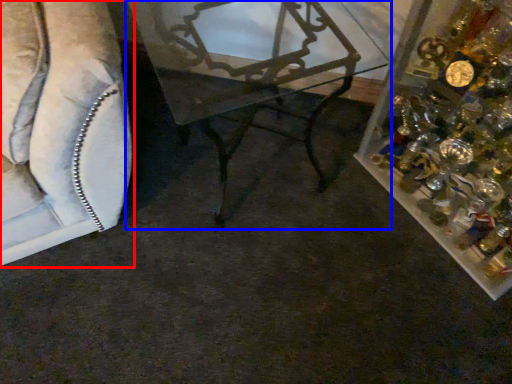
Question: Which object appears closest to the camera in this image, furniture (highlighted by a red box) or table (highlighted by a blue box)?

Choices:
 (A) furniture
 (B) table

Answer: (A)